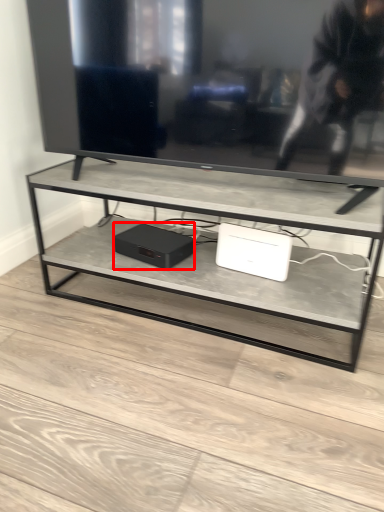
Question: Observing the image, what is the correct spatial positioning of computer (annotated by the red box) in reference to computer?

Choices:
 (A) right
 (B) left

Answer: (B)